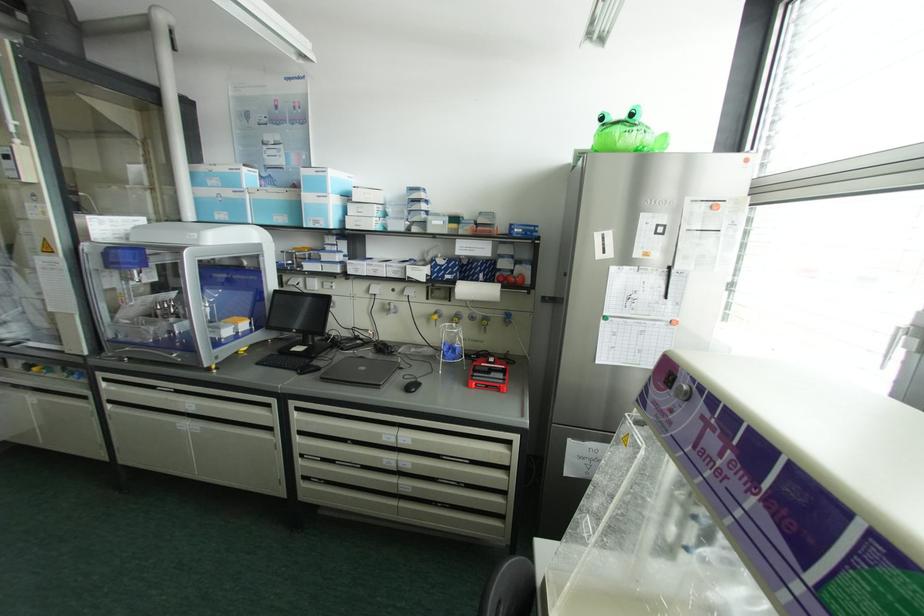
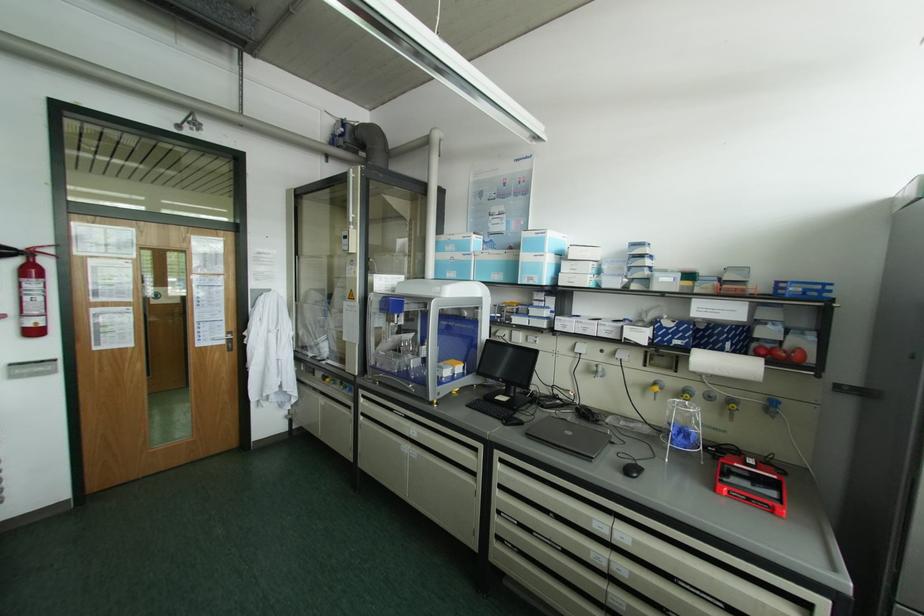
Where in the second image is the point corresponding to (x=387, y=435) from the first image?

(600, 523)